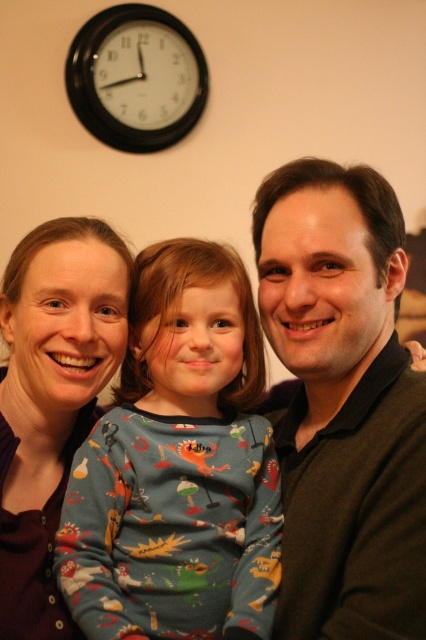
Which is more to the right, dark brown sweater at center or black plastic clock at upper left?

Positioned to the right is dark brown sweater at center.

Who is positioned more to the left, dark brown sweater at center or black plastic clock at upper left?

Positioned to the left is black plastic clock at upper left.

This screenshot has height=640, width=426. Identify the location of dark brown sweater at center. (342, 403).

Locate an element on the screen. This screenshot has width=426, height=640. dark brown sweater at center is located at coordinates (342, 403).

Can you confirm if dark brown sweater at center is taller than matte brown hair at center?

Correct, dark brown sweater at center is much taller as matte brown hair at center.

Does dark brown sweater at center appear on the left side of matte brown hair at center?

In fact, dark brown sweater at center is to the right of matte brown hair at center.

You are a GUI agent. You are given a task and a screenshot of the screen. Output one action in this format:
    pyautogui.click(x=<x>, y=<y>)
    Task: Click on the dark brown sweater at center
    This screenshot has height=640, width=426.
    Given the screenshot: What is the action you would take?
    pyautogui.click(x=342, y=403)

Can you confirm if printed cotton pajamas at center is positioned above matte brown hair at center?

Actually, printed cotton pajamas at center is below matte brown hair at center.

Is point (258, 365) farther from camera compared to point (94, 419)?

No.

Between point (167, 282) and point (43, 532), which one is positioned behind?

Point (43, 532)

Identify the location of printed cotton pajamas at center. (178, 467).